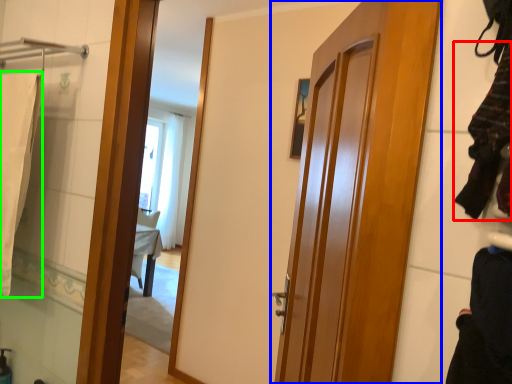
Question: Which object is positioned closest to clothing (highlighted by a red box)? Select from door (highlighted by a blue box) and bath towel (highlighted by a green box).

Choices:
 (A) door
 (B) bath towel

Answer: (A)